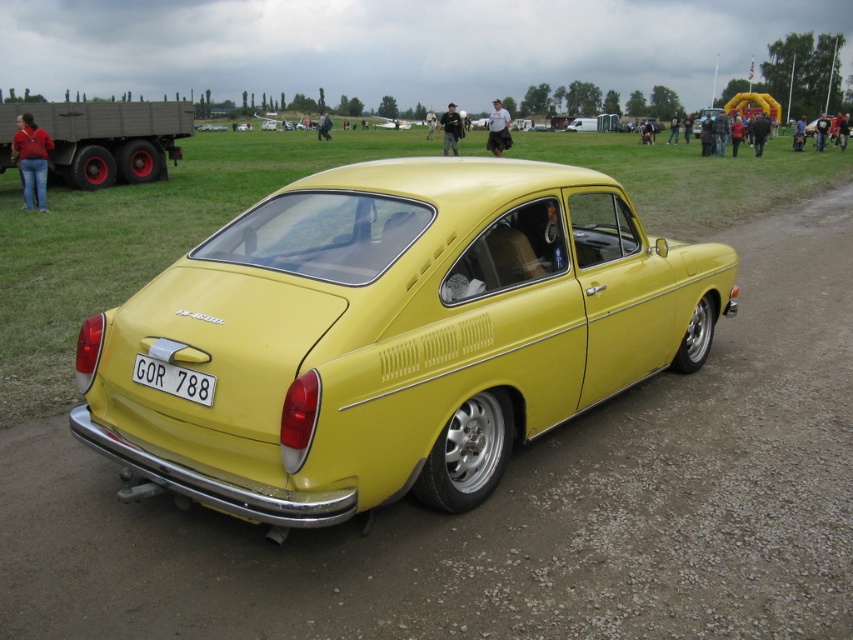
Question: Can you confirm if yellow matte car at center is positioned to the right of white plastic license plate at rear?

Choices:
 (A) no
 (B) yes

Answer: (B)

Question: From the image, what is the correct spatial relationship of yellow matte car at center in relation to white plastic license plate at rear?

Choices:
 (A) above
 (B) below

Answer: (A)

Question: Among these points, which one is nearest to the camera?

Choices:
 (A) (614, 368)
 (B) (178, 392)

Answer: (B)

Question: Which point is closer to the camera?

Choices:
 (A) yellow matte car at center
 (B) white plastic license plate at rear

Answer: (A)

Question: Where is yellow matte car at center located in relation to white plastic license plate at rear in the image?

Choices:
 (A) right
 (B) left

Answer: (A)